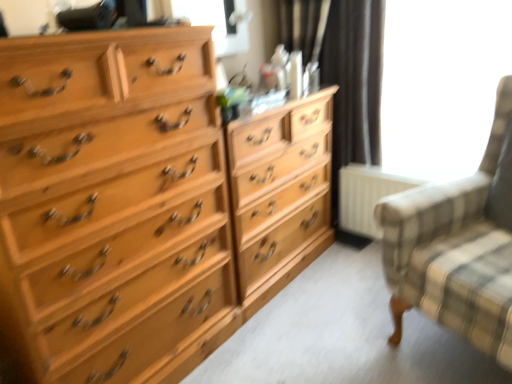
You are a GUI agent. You are given a task and a screenshot of the screen. Output one action in this format:
    pyautogui.click(x=<x>, y=<y>)
    Task: Click on the light wood dresser at center
    The width and height of the screenshot is (512, 384).
    Given the screenshot: What is the action you would take?
    pyautogui.click(x=280, y=194)

Describe the element at coordinates (441, 84) in the screenshot. I see `transparent glass window at upper right, acting as the first window screen starting from the right` at that location.

The height and width of the screenshot is (384, 512). What do you see at coordinates (367, 196) in the screenshot? I see `white matte radiator at lower right` at bounding box center [367, 196].

Measure the distance between point (511,340) and camera.

A distance of 1.26 meters exists between point (511,340) and camera.

Where is `clear glass window screen at upper center, which is counted as the second window screen, starting from the right`? This screenshot has height=384, width=512. clear glass window screen at upper center, which is counted as the second window screen, starting from the right is located at coordinates (217, 22).

I want to click on light wood chest of drawers at left, so click(145, 204).

From a real-world perspective, which object rests below the other?

light wood chest of drawers at left is physically lower.

Can you see black fabric curtain at upper center touching light wood chest of drawers at left?

No, black fabric curtain at upper center is not with light wood chest of drawers at left.

From the image's perspective, does black fabric curtain at upper center appear higher than light wood chest of drawers at left?

Yes.

Is black fabric curtain at upper center spatially inside light wood chest of drawers at left, or outside of it?

black fabric curtain at upper center cannot be found inside light wood chest of drawers at left.

Is plaid fabric rocking chair at right facing towards transparent glass window at upper right, acting as the first window screen starting from the right?

No, plaid fabric rocking chair at right is not turned towards transparent glass window at upper right, acting as the first window screen starting from the right.

Considering the points (426, 271) and (393, 26), which point is in front, point (426, 271) or point (393, 26)?

The point (426, 271) is more forward.

How different are the orientations of plaid fabric rocking chair at right and transparent glass window at upper right, which is the second window screen from left to right, in degrees?

plaid fabric rocking chair at right and transparent glass window at upper right, which is the second window screen from left to right, are facing 21.8 degrees away from each other.

Is transparent glass window at upper right, which is the second window screen from left to right, surrounded by plaid fabric rocking chair at right?

Actually, transparent glass window at upper right, which is the second window screen from left to right, is outside plaid fabric rocking chair at right.

Which point is more distant from viewer, (x=337, y=7) or (x=389, y=94)?

Point (x=389, y=94)

From a real-world perspective, is black fabric curtain at upper center located higher than transparent glass window at upper right, which is the second window screen from left to right?

No, from a real-world perspective, black fabric curtain at upper center is not on top of transparent glass window at upper right, which is the second window screen from left to right.

From the image's perspective, which object appears higher, black fabric curtain at upper center or transparent glass window at upper right, which is the second window screen from left to right?

transparent glass window at upper right, which is the second window screen from left to right.

Is black fabric curtain at upper center positioned beyond the bounds of transparent glass window at upper right, acting as the first window screen starting from the right?

That's correct, black fabric curtain at upper center is outside of transparent glass window at upper right, acting as the first window screen starting from the right.

The width and height of the screenshot is (512, 384). Find the location of `rocking chair that appears in front of the transparent glass window at upper right, acting as the first window screen starting from the right`. rocking chair that appears in front of the transparent glass window at upper right, acting as the first window screen starting from the right is located at coordinates (457, 246).

Is transparent glass window at upper right, acting as the first window screen starting from the right, positioned beyond the bounds of plaid fabric rocking chair at right?

Yes, transparent glass window at upper right, acting as the first window screen starting from the right, is outside of plaid fabric rocking chair at right.

Considering the relative sizes of transparent glass window at upper right, which is the second window screen from left to right, and plaid fabric rocking chair at right in the image provided, is transparent glass window at upper right, which is the second window screen from left to right, shorter than plaid fabric rocking chair at right?

Yes, transparent glass window at upper right, which is the second window screen from left to right, is shorter than plaid fabric rocking chair at right.

Which point is more forward, (44, 171) or (319, 145)?

The point (44, 171) is closer to the camera.

Does light wood chest of drawers at left lie behind light wood dresser at center?

No, light wood chest of drawers at left is in front of light wood dresser at center.

From a real-world perspective, is light wood chest of drawers at left over light wood dresser at center?

Correct, in the physical world, light wood chest of drawers at left is higher than light wood dresser at center.

Is black fabric curtain at upper center oriented away from plaid fabric rocking chair at right?

black fabric curtain at upper center is not turned away from plaid fabric rocking chair at right.

From the image's perspective, is black fabric curtain at upper center on top of plaid fabric rocking chair at right?

Correct, black fabric curtain at upper center appears higher than plaid fabric rocking chair at right in the image.

Is black fabric curtain at upper center in front of or behind plaid fabric rocking chair at right in the image?

black fabric curtain at upper center is behind plaid fabric rocking chair at right.

Would you consider black fabric curtain at upper center to be distant from plaid fabric rocking chair at right?

No, there isn't a large distance between black fabric curtain at upper center and plaid fabric rocking chair at right.

Identify the location of the 2nd window screen located above the black fabric curtain at upper center (from a real-world perspective). (217, 22).

Which is closer, [188,7] or [281,31]?

Clearly, point [188,7] is closer to the camera than point [281,31].

Could you measure the distance between clear glass window screen at upper center, which is counted as the second window screen, starting from the right, and black fabric curtain at upper center?

A distance of 53.00 centimeters exists between clear glass window screen at upper center, which is counted as the second window screen, starting from the right, and black fabric curtain at upper center.

Is clear glass window screen at upper center, which is counted as the second window screen, starting from the right, in front of black fabric curtain at upper center?

Yes, clear glass window screen at upper center, which is counted as the second window screen, starting from the right, is closer to the viewer.

Locate an element on the screen. This screenshot has height=384, width=512. the chest of drawers in front of the black fabric curtain at upper center is located at coordinates (145, 204).

From a real-world perspective, which window screen is the 1st one above the plaid fabric rocking chair at right? Please provide its 2D coordinates.

[(441, 84)]

From the image, which object appears to be nearer to white matte radiator at lower right, plaid fabric rocking chair at right or light wood dresser at center?

light wood dresser at center is closer to white matte radiator at lower right.

Consider the image. Which object lies further to the anchor point clear glass window screen at upper center, which is the first window screen from left to right, white matte radiator at lower right or light wood chest of drawers at left?

white matte radiator at lower right.

When comparing their distances from light wood chest of drawers at left, does plaid fabric rocking chair at right or light wood dresser at center seem closer?

light wood dresser at center.

Which object lies nearer to the anchor point black fabric curtain at upper center, clear glass window screen at upper center, which is the first window screen from left to right, or light wood dresser at center?

Based on the image, light wood dresser at center appears to be nearer to black fabric curtain at upper center.

Which object lies nearer to the anchor point transparent glass window at upper right, acting as the first window screen starting from the right, white matte radiator at lower right or plaid fabric rocking chair at right?

white matte radiator at lower right is positioned closer to the anchor transparent glass window at upper right, acting as the first window screen starting from the right.

From the image, which object appears to be farther from plaid fabric rocking chair at right, black fabric curtain at upper center or clear glass window screen at upper center, which is counted as the second window screen, starting from the right?

clear glass window screen at upper center, which is counted as the second window screen, starting from the right, is positioned further to the anchor plaid fabric rocking chair at right.

Considering their positions, is plaid fabric rocking chair at right positioned further to clear glass window screen at upper center, which is the first window screen from left to right, than transparent glass window at upper right, which is the second window screen from left to right?

plaid fabric rocking chair at right.

Which object lies further to the anchor point white matte radiator at lower right, black fabric curtain at upper center or transparent glass window at upper right, acting as the first window screen starting from the right?

Based on the image, transparent glass window at upper right, acting as the first window screen starting from the right, appears to be further to white matte radiator at lower right.

The width and height of the screenshot is (512, 384). Find the location of `radiator between light wood dresser at center and transparent glass window at upper right, acting as the first window screen starting from the right, in the horizontal direction`. radiator between light wood dresser at center and transparent glass window at upper right, acting as the first window screen starting from the right, in the horizontal direction is located at coordinates (367, 196).

Locate an element on the screen. Image resolution: width=512 pixels, height=384 pixels. curtain located between clear glass window screen at upper center, which is counted as the second window screen, starting from the right, and white matte radiator at lower right in the left-right direction is located at coordinates pyautogui.click(x=354, y=78).

The height and width of the screenshot is (384, 512). I want to click on dresser between plaid fabric rocking chair at right and white matte radiator at lower right in the front-back direction, so click(280, 194).

Locate an element on the screen. radiator between light wood chest of drawers at left and transparent glass window at upper right, acting as the first window screen starting from the right, from left to right is located at coordinates (367, 196).